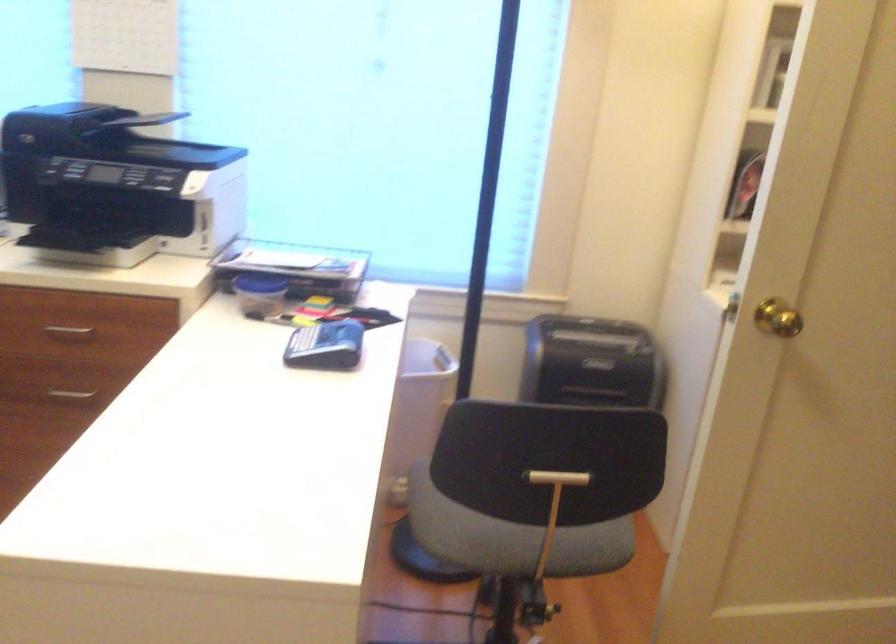
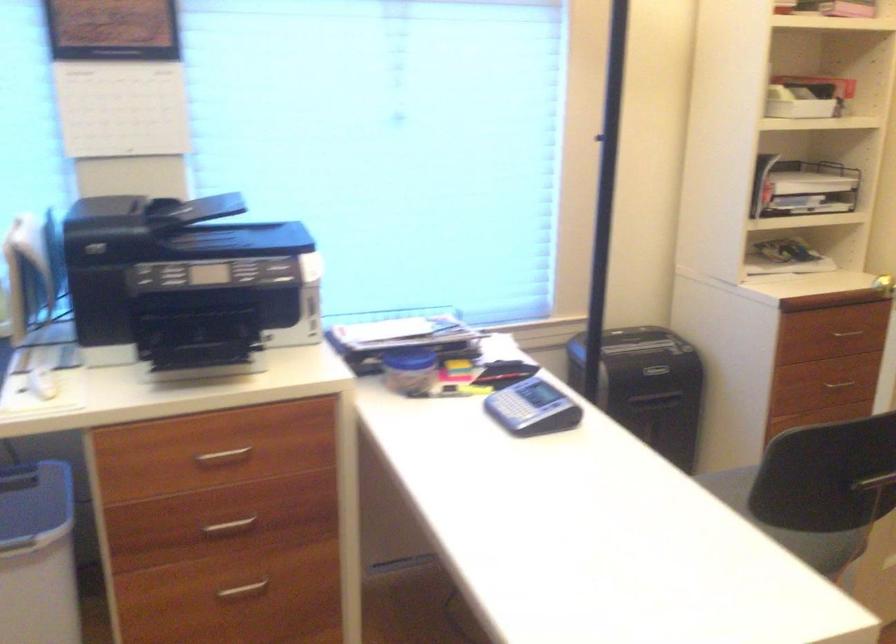
In the second image, find the point that corresponds to (554,524) in the first image.

(788, 525)